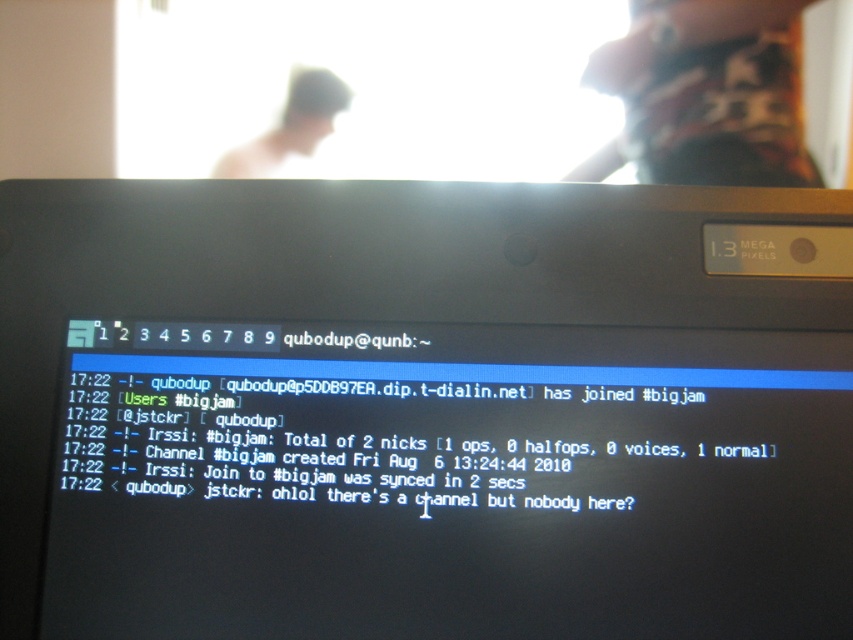
You are a person sitting in front of the computer screen. You notice the black glossy laptop at center and the blurred skin head at upper center. Which object is closer to you?

The black glossy laptop at center is closer to you because it is in front of the blurred skin head at upper center.

You are a photographer trying to capture a closeup of the dark red fabric shirt at upper right and the blurred skin head at upper center. Which object should you zoom in on to ensure both fit within the frame without cropping?

The dark red fabric shirt at upper right is wider than the blurred skin head at upper center, so you should zoom in on the blurred skin head at upper center to ensure both fit within the frame without cropping.

You are a user trying to focus on the black glossy laptop at center but notice the blurred skin head at upper center. Which object is closer to your line of sight?

Result: The blurred skin head at upper center is closer to your line of sight because it is positioned to the left of the black glossy laptop at center.